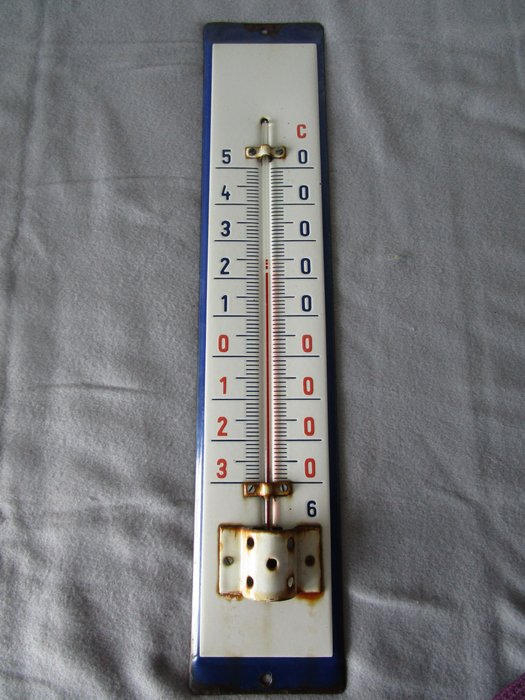
Image resolution: width=525 pixels, height=700 pixels. I want to click on grey sheet, so [128, 598], [119, 628].